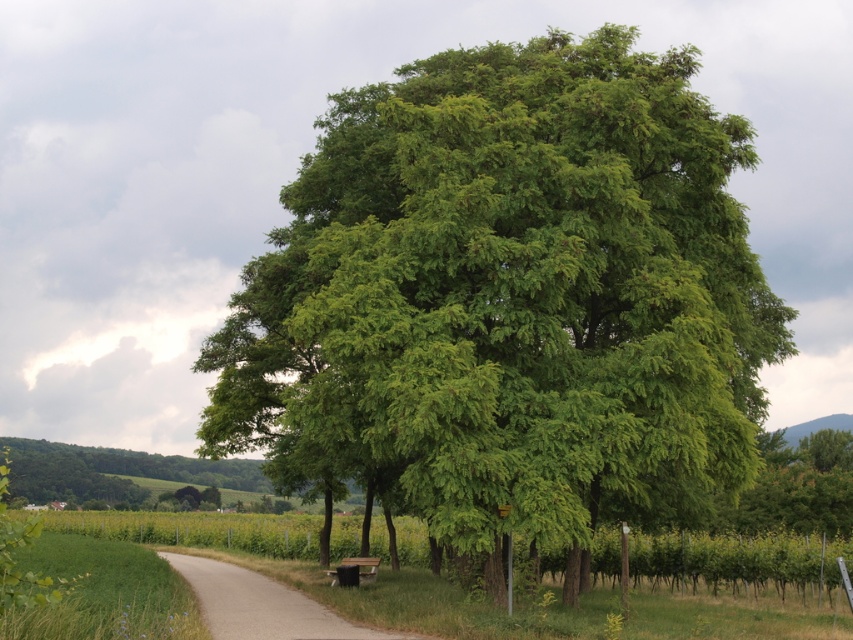
Question: Can you confirm if green leafy tree at center is thinner than gray concrete path at center?

Choices:
 (A) no
 (B) yes

Answer: (A)

Question: Can you confirm if green leafy tree at center is positioned to the right of gray concrete path at center?

Choices:
 (A) no
 (B) yes

Answer: (B)

Question: Which point appears farthest from the camera in this image?

Choices:
 (A) (685, 326)
 (B) (370, 576)
 (C) (416, 634)

Answer: (B)

Question: Can you confirm if green leafy tree at center is thinner than wooden park bench at lower center?

Choices:
 (A) no
 (B) yes

Answer: (A)

Question: Which object appears closest to the camera in this image?

Choices:
 (A) wooden park bench at lower center
 (B) gray concrete path at center
 (C) green leafy tree at center

Answer: (C)

Question: Which of the following is the farthest from the observer?

Choices:
 (A) green leafy tree at center
 (B) wooden park bench at lower center
 (C) gray concrete path at center

Answer: (B)